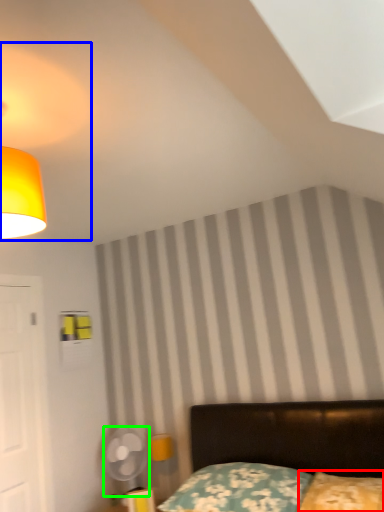
Question: Which object is positioned farthest from pillow (highlighted by a red box)? Select from lamp (highlighted by a blue box) and mechanical fan (highlighted by a green box).

Choices:
 (A) lamp
 (B) mechanical fan

Answer: (A)